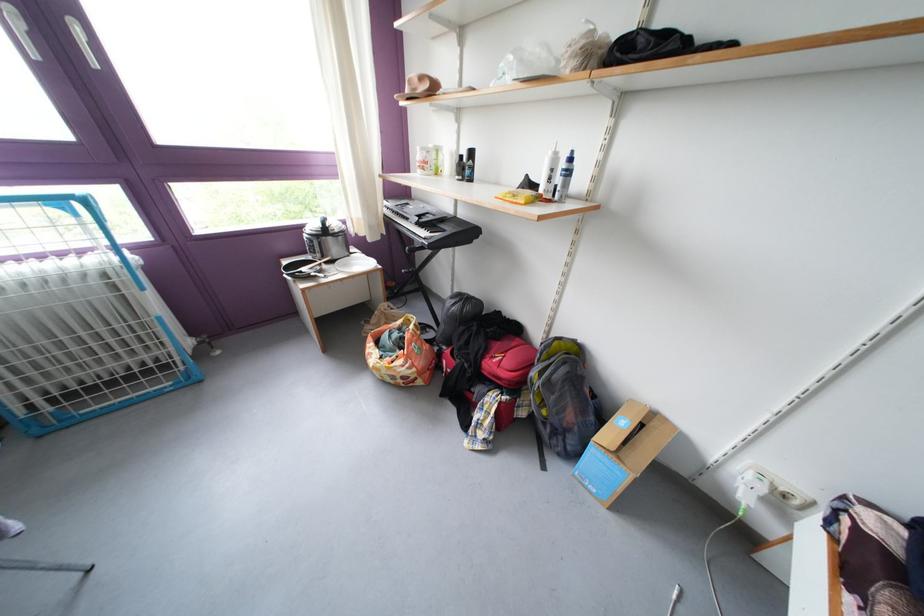
Which object does [468,164] point to?

This point indicates the black spray can.